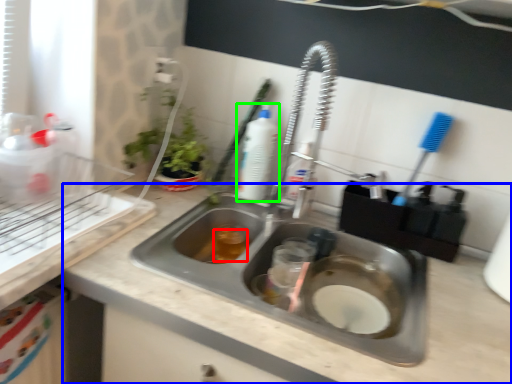
Question: Which is nearer to the liquid (highlighted by a red box)? counter top (highlighted by a blue box) or cleaning product (highlighted by a green box).

Choices:
 (A) counter top
 (B) cleaning product

Answer: (B)